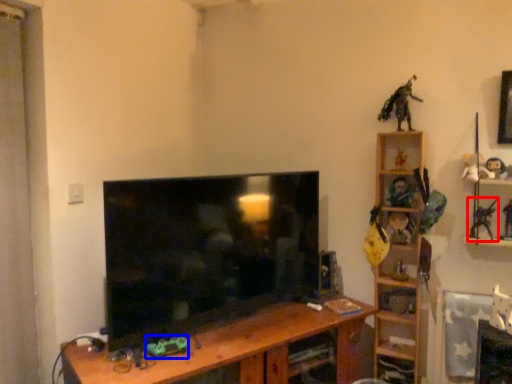
Question: Which object appears farthest to the camera in this image, toy (highlighted by a red box) or toy (highlighted by a blue box)?

Choices:
 (A) toy
 (B) toy

Answer: (A)